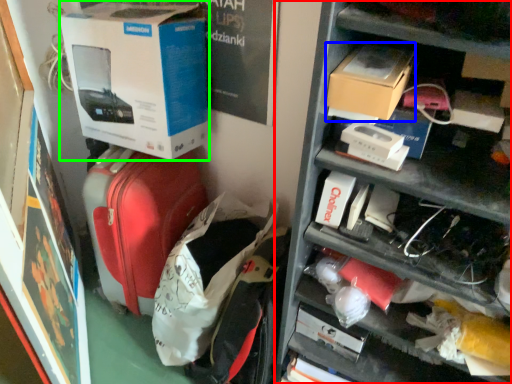
Question: Estimate the real-world distances between objects in this image. Which object is closer to shelf (highlighted by a red box), cardboard box (highlighted by a blue box) or box (highlighted by a green box)?

Choices:
 (A) cardboard box
 (B) box

Answer: (A)